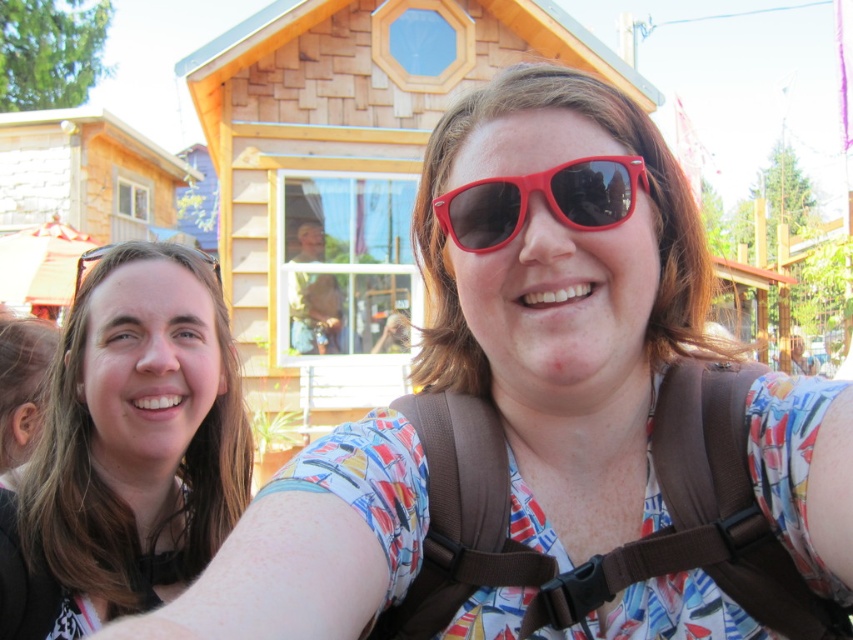
You are a photographer trying to focus on the brown fabric strap at center in the image. What are the exact coordinates where you should adjust your camera focus to capture it precisely?

The exact coordinates to focus on the brown fabric strap at center are point (618, 547).

You are planning to take a photo of the wooden cabin at center and the brown fabric strap at center. Which object should you focus on first if you want to capture both in a single shot without moving the camera?

You should focus on the wooden cabin at center first because it is taller than the brown fabric strap at center, allowing you to frame the shot to include both objects effectively.